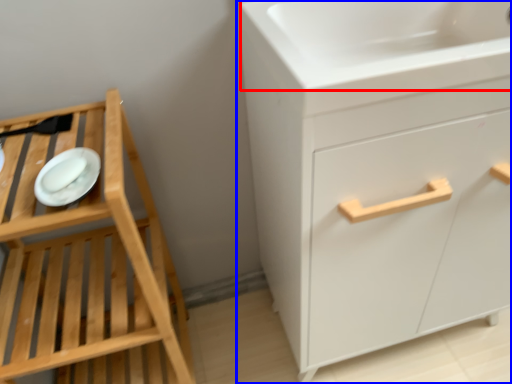
Question: Which object is closer to the camera taking this photo, sink (highlighted by a red box) or chest of drawers (highlighted by a blue box)?

Choices:
 (A) sink
 (B) chest of drawers

Answer: (B)